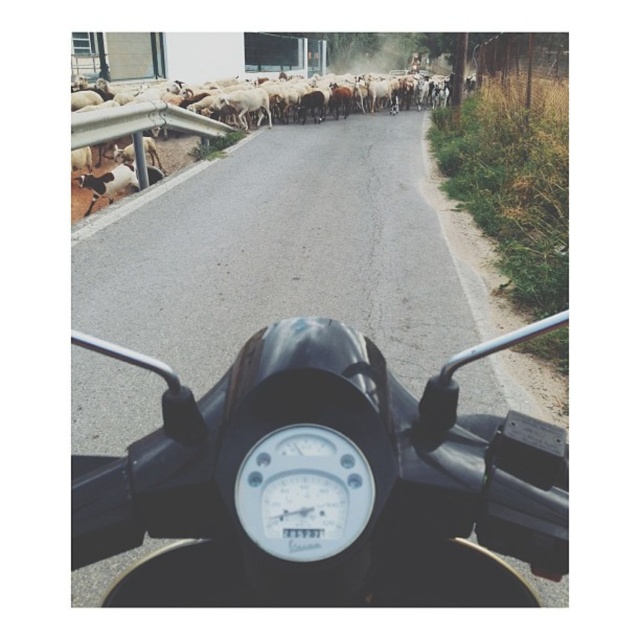
Is black matte motorcycle at center wider than white woolen sheep at upper left?

Incorrect, black matte motorcycle at center's width does not surpass white woolen sheep at upper left's.

This screenshot has height=640, width=640. Find the location of `black matte motorcycle at center`. black matte motorcycle at center is located at coordinates (323, 476).